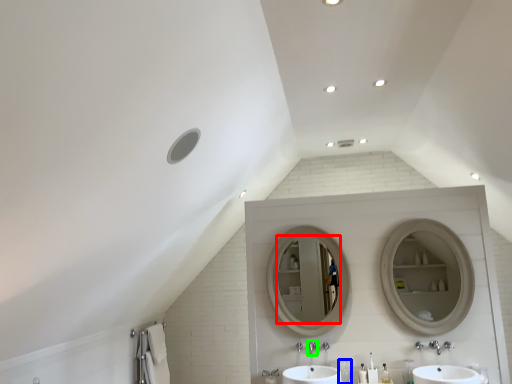
Question: Considering the real-world distances, which object is closest to mirror (highlighted by a red box)? toiletry (highlighted by a blue box) or plumbing fixture (highlighted by a green box).

Choices:
 (A) toiletry
 (B) plumbing fixture

Answer: (B)